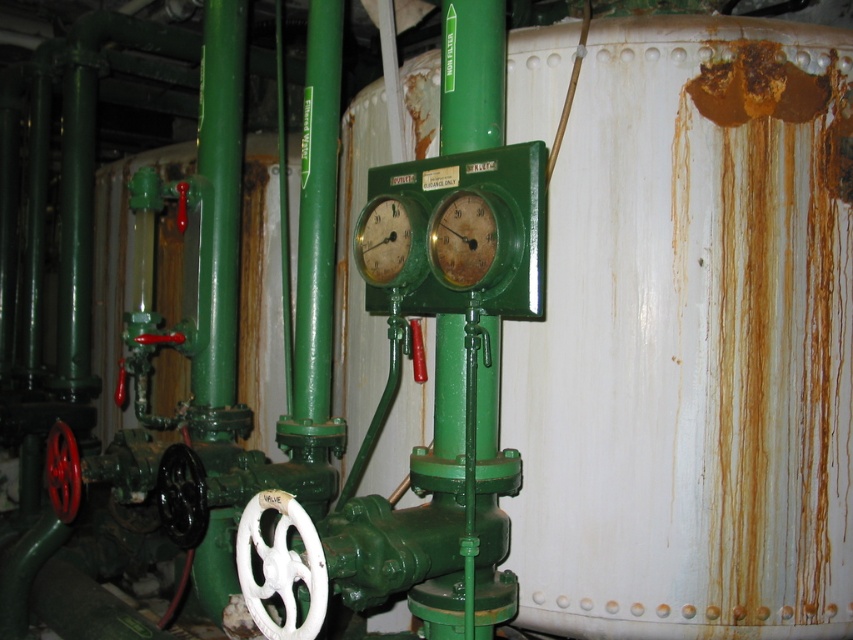
Question: Among these objects, which one is nearest to the camera?

Choices:
 (A) green matte gauge at center
 (B) rusty metal gauge at center

Answer: (B)

Question: Does rusty metal gauge at center have a greater width compared to green matte gauge at center?

Choices:
 (A) no
 (B) yes

Answer: (A)

Question: Can you confirm if rusty metal gauge at center is positioned to the right of green matte gauge at center?

Choices:
 (A) yes
 (B) no

Answer: (A)

Question: Is rusty metal gauge at center smaller than green matte gauge at center?

Choices:
 (A) yes
 (B) no

Answer: (A)